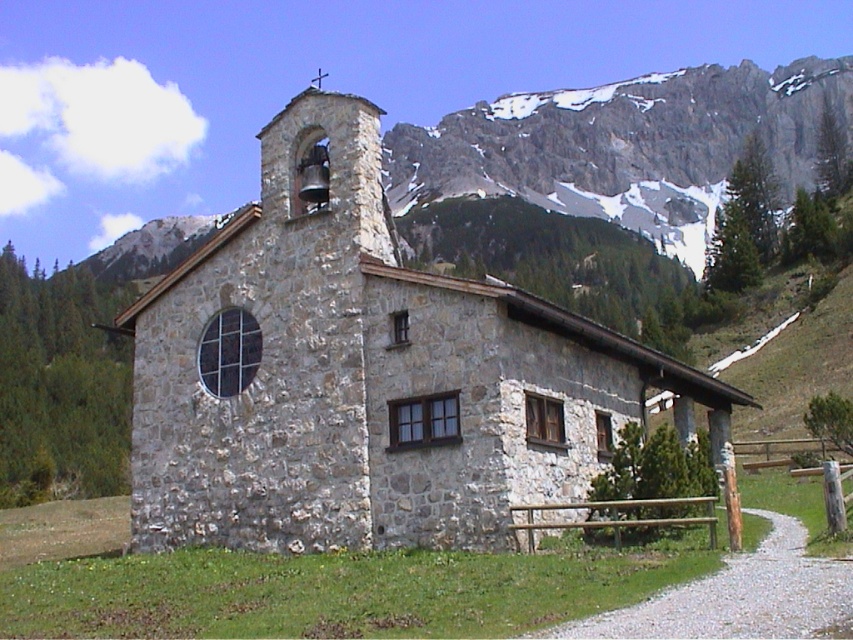
You are standing at point (368, 376) in the image. What structure are you directly facing?

You are directly facing the stone church at center located at point (368, 376).

You are a hiker who has just reached the summit and wants to take a photo of the stone church at center and the gray rocky mountain at upper center. Based on their positions, which object should you focus on first to ensure both are in the frame?

The stone church at center is located below the gray rocky mountain at upper center, so you should focus on the gray rocky mountain at upper center first to ensure both are in the frame.